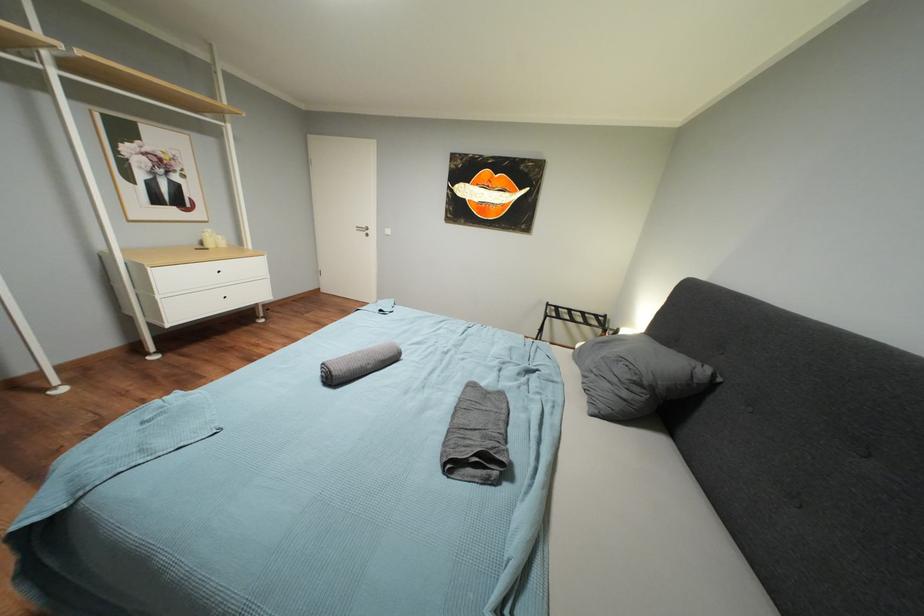
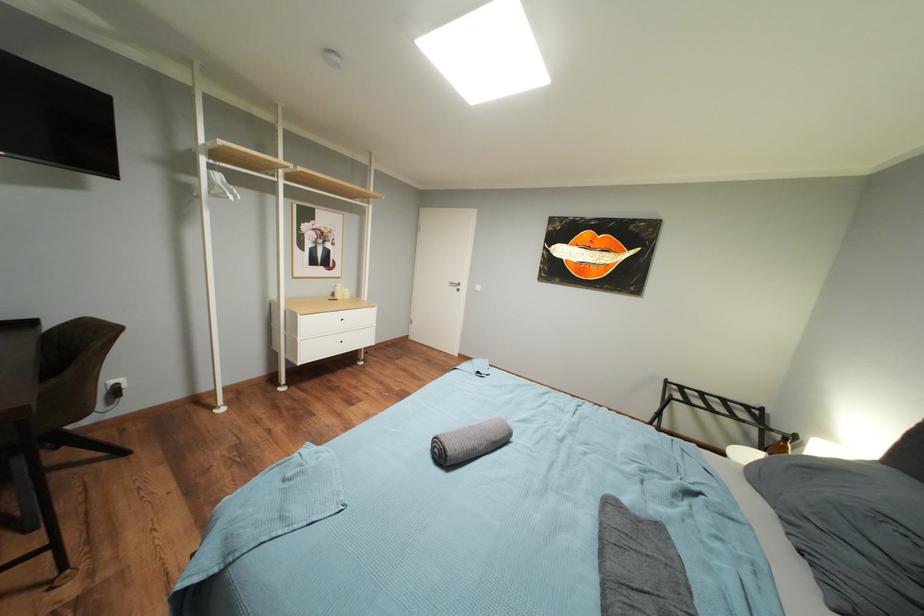
Question: The images are taken continuously from a first-person perspective. In which direction is your viewpoint rotating?

Choices:
 (A) Left
 (B) Right
 (C) Up
 (D) Down

Answer: (A)